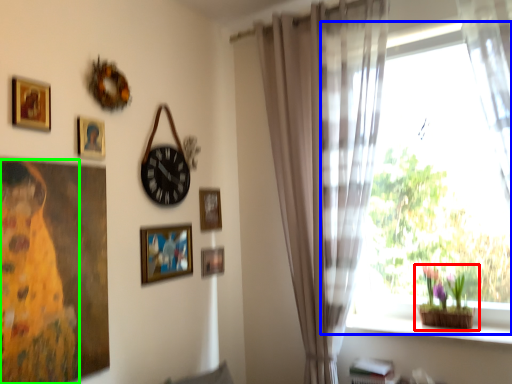
Question: Which is nearer to the houseplant (highlighted by a red box)? window (highlighted by a blue box) or woman (highlighted by a green box).

Choices:
 (A) window
 (B) woman

Answer: (A)